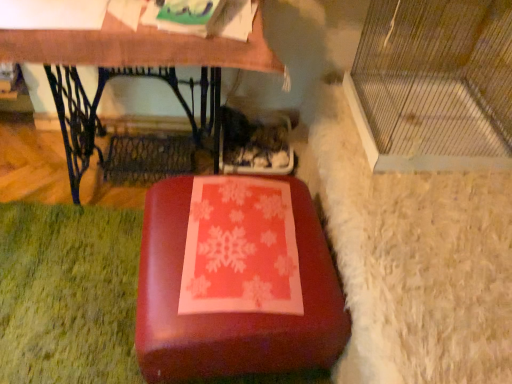
Question: Is matte red suitcase at center in front of clear plastic cage at right?

Choices:
 (A) no
 (B) yes

Answer: (A)

Question: From a real-world perspective, does matte red suitcase at center sit lower than clear plastic cage at right?

Choices:
 (A) yes
 (B) no

Answer: (A)

Question: Can you confirm if matte red suitcase at center is shorter than clear plastic cage at right?

Choices:
 (A) yes
 (B) no

Answer: (A)

Question: From the image's perspective, is matte red suitcase at center below clear plastic cage at right?

Choices:
 (A) no
 (B) yes

Answer: (B)

Question: Is matte red suitcase at center positioned with its back to clear plastic cage at right?

Choices:
 (A) no
 (B) yes

Answer: (A)

Question: Is matte red suitcase at center touching clear plastic cage at right?

Choices:
 (A) yes
 (B) no

Answer: (B)

Question: Is clear plastic cage at right located outside matte wood table at center?

Choices:
 (A) no
 (B) yes

Answer: (B)

Question: From a real-world perspective, is clear plastic cage at right under matte wood table at center?

Choices:
 (A) yes
 (B) no

Answer: (B)

Question: Is clear plastic cage at right positioned with its back to matte wood table at center?

Choices:
 (A) no
 (B) yes

Answer: (A)

Question: Considering the relative sizes of clear plastic cage at right and matte wood table at center in the image provided, is clear plastic cage at right thinner than matte wood table at center?

Choices:
 (A) yes
 (B) no

Answer: (B)

Question: Is clear plastic cage at right further to the viewer compared to matte wood table at center?

Choices:
 (A) no
 (B) yes

Answer: (A)

Question: From the image's perspective, is clear plastic cage at right over matte wood table at center?

Choices:
 (A) no
 (B) yes

Answer: (B)

Question: Considering the relative sizes of matte wood table at center and matte red suitcase at center in the image provided, is matte wood table at center bigger than matte red suitcase at center?

Choices:
 (A) yes
 (B) no

Answer: (A)